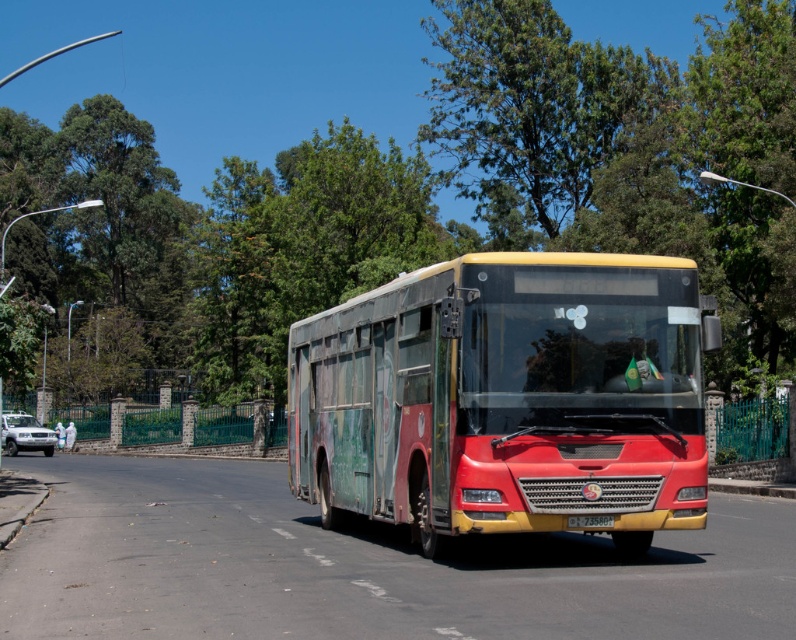
Does point (41, 429) lie behind point (599, 529)?

Yes, it is behind point (599, 529).

Does metallic silver suv at lower left have a larger size compared to yellow matte license plate at center?

Correct, metallic silver suv at lower left is larger in size than yellow matte license plate at center.

You are a GUI agent. You are given a task and a screenshot of the screen. Output one action in this format:
    pyautogui.click(x=<x>, y=<y>)
    Task: Click on the metallic silver suv at lower left
    
    Given the screenshot: What is the action you would take?
    pyautogui.click(x=25, y=435)

At what (x,y) coordinates should I click in order to perform the action: click on metallic silver suv at lower left. Please return your answer as a coordinate pair (x, y). The image size is (796, 640). Looking at the image, I should click on (25, 435).

Is point (644, 484) positioned behind point (36, 438)?

No, (644, 484) is closer to viewer.

Can you confirm if rusty metal bus at center is bigger than metallic silver suv at lower left?

No, rusty metal bus at center is not bigger than metallic silver suv at lower left.

Identify the location of rusty metal bus at center. (506, 397).

Can you confirm if green leafy tree at upper center is taller than yellow matte license plate at center?

Yes.

Is green leafy tree at upper center smaller than yellow matte license plate at center?

Incorrect, green leafy tree at upper center is not smaller in size than yellow matte license plate at center.

I want to click on green leafy tree at upper center, so click(x=539, y=115).

Locate an element on the screen. green leafy tree at upper center is located at coordinates (539, 115).